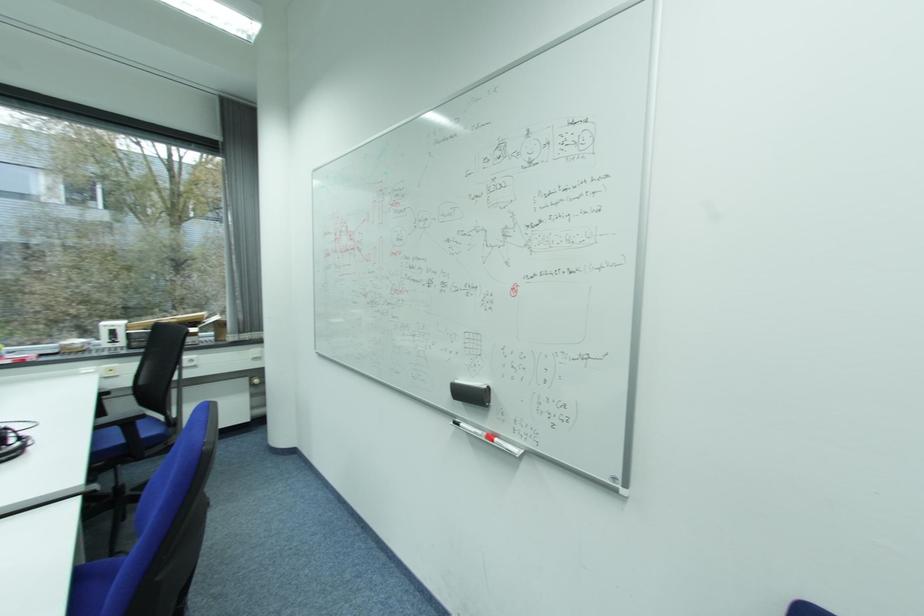
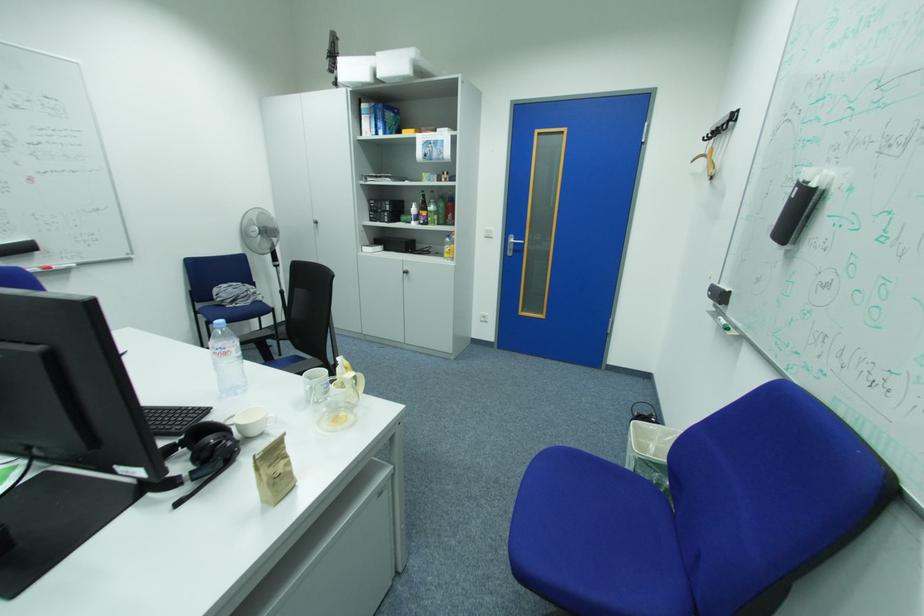
Locate, in the second image, the point that corresponds to (516,228) in the first image.

(14, 140)